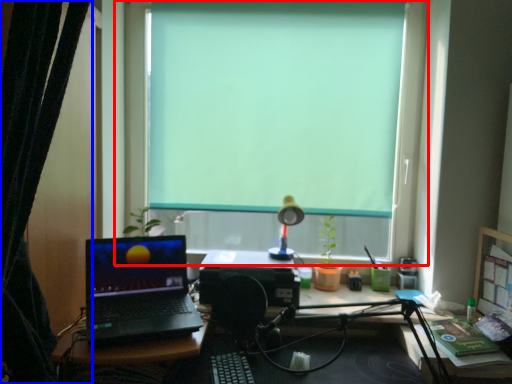
Question: Which point is closer to the camera, window (highlighted by a red box) or curtain (highlighted by a blue box)?

Choices:
 (A) window
 (B) curtain

Answer: (B)